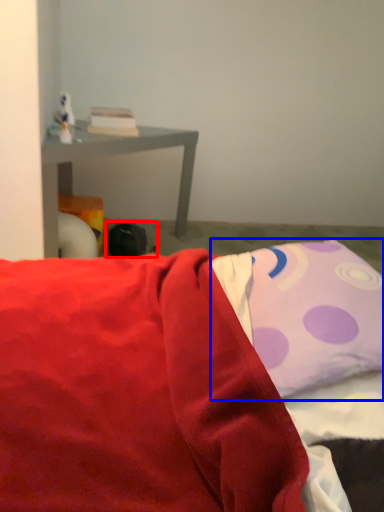
Question: Among these objects, which one is farthest to the camera, bean bag chair (highlighted by a red box) or pillow (highlighted by a blue box)?

Choices:
 (A) bean bag chair
 (B) pillow

Answer: (A)